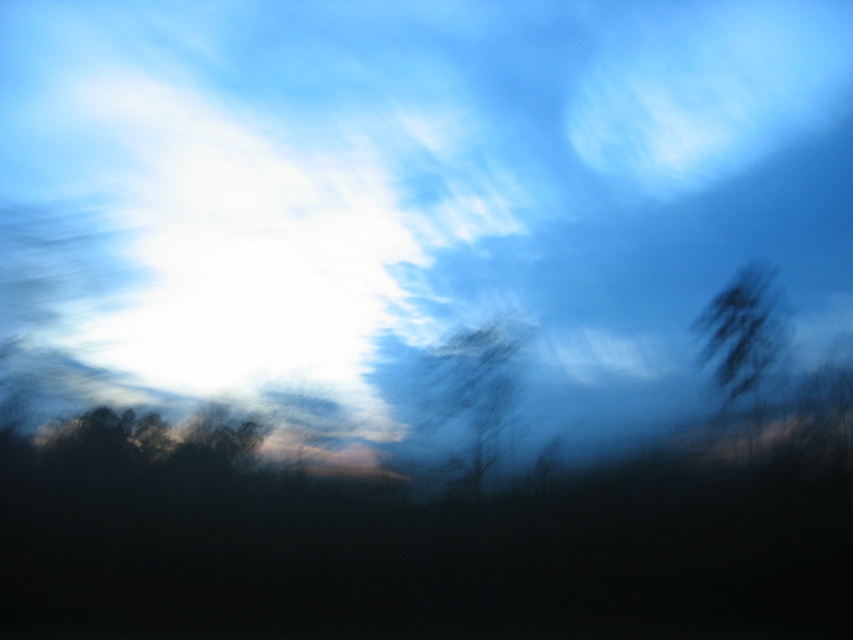
Consider the image. Between white fluffy cloud at upper center and dark brown textured tree at center, which one is positioned higher?

Positioned higher is white fluffy cloud at upper center.

Can you confirm if white fluffy cloud at upper center is wider than dark brown textured tree at center?

Correct, the width of white fluffy cloud at upper center exceeds that of dark brown textured tree at center.

What do you see at coordinates (434, 182) in the screenshot?
I see `white fluffy cloud at upper center` at bounding box center [434, 182].

I want to click on white fluffy cloud at upper center, so (x=434, y=182).

Is dark brown textured tree at center closer to the viewer compared to dark green textured tree at right?

That is True.

At what (x,y) coordinates should I click in order to perform the action: click on dark brown textured tree at center. Please return your answer as a coordinate pair (x, y). This screenshot has width=853, height=640. Looking at the image, I should click on (471, 397).

Locate an element on the screen. The image size is (853, 640). dark brown textured tree at center is located at coordinates (471, 397).

Is white fluffy cloud at upper center shorter than dark green textured tree at right?

Incorrect, white fluffy cloud at upper center's height does not fall short of dark green textured tree at right's.

Is point (612, 72) less distant than point (759, 308)?

No, (612, 72) is further to viewer.

Image resolution: width=853 pixels, height=640 pixels. Find the location of `white fluffy cloud at upper center`. white fluffy cloud at upper center is located at coordinates (434, 182).